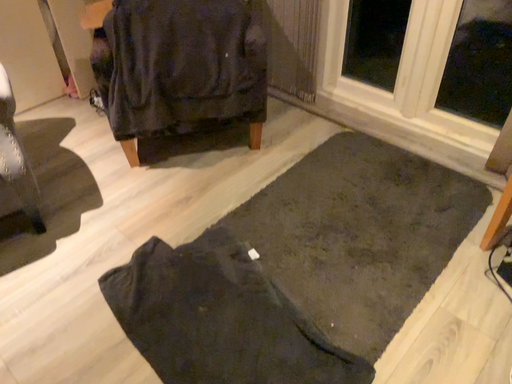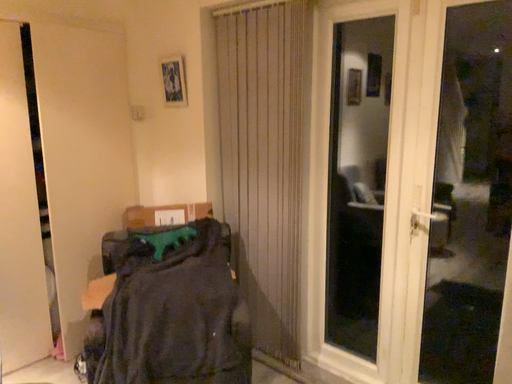
Question: Which way did the camera rotate in the video?

Choices:
 (A) rotated upward
 (B) rotated downward

Answer: (A)